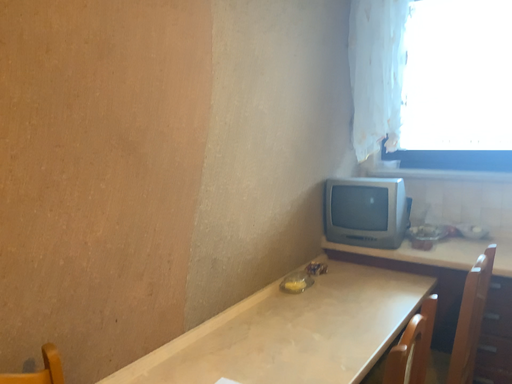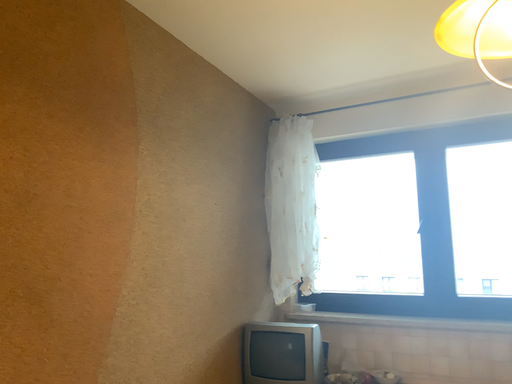
Question: How did the camera likely rotate when shooting the video?

Choices:
 (A) rotated left
 (B) rotated right

Answer: (B)